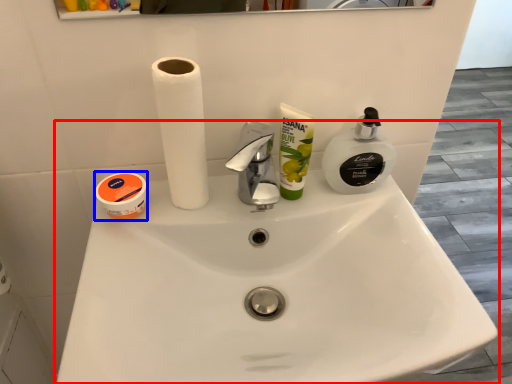
Question: Which point is further to the camera, sink (highlighted by a red box) or toiletry (highlighted by a blue box)?

Choices:
 (A) sink
 (B) toiletry

Answer: (B)